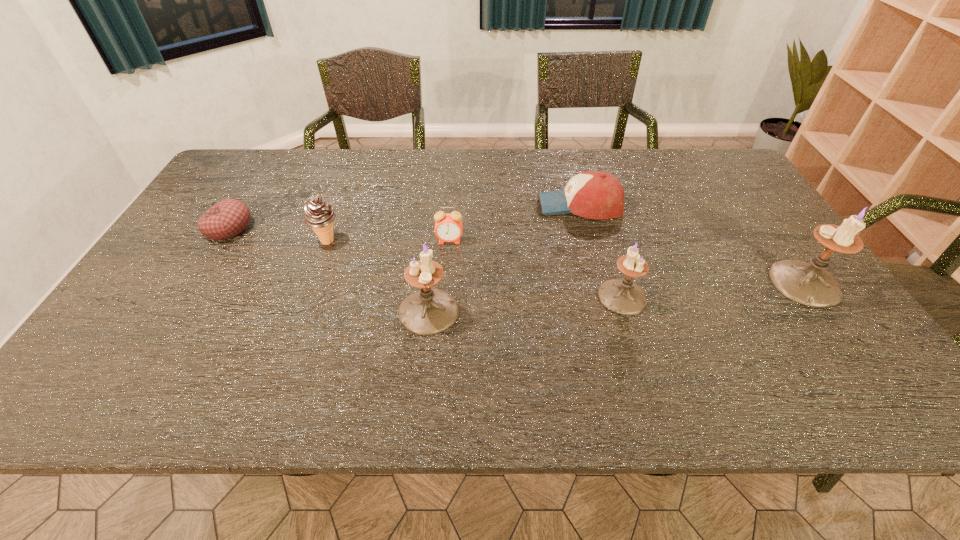
You are a GUI agent. You are given a task and a screenshot of the screen. Output one action in this format:
    pyautogui.click(x=<x>, y=<y>)
    Task: Click on the object at the right edge
    The image size is (960, 540).
    Given the screenshot: What is the action you would take?
    pyautogui.click(x=810, y=284)

Find the location of a particular element. vacant space at the far edge is located at coordinates (540, 171).

You are a GUI agent. You are given a task and a screenshot of the screen. Output one action in this format:
    pyautogui.click(x=<x>, y=<y>)
    Task: Click on the vacant space at the left edge of the desktop
    The width and height of the screenshot is (960, 540).
    Given the screenshot: What is the action you would take?
    pyautogui.click(x=256, y=196)

Locate an element on the screen. free space at the near left corner of the desktop is located at coordinates (123, 355).

This screenshot has height=540, width=960. Identify the location of free space at the far right corner. (692, 164).

Locate an element on the screen. The height and width of the screenshot is (540, 960). free point between the icecream and the rightmost object is located at coordinates (566, 262).

Find the location of a particular element. The width and height of the screenshot is (960, 540). free space between the baseball cap and the shortest object is located at coordinates (404, 217).

Locate an element on the screen. This screenshot has width=960, height=540. free space between the baseball cap and the second shortest candle holder is located at coordinates point(504,258).

Identify the location of unoccupied area between the alarm clock and the sixth object from right to left. (389, 241).

Where is `free space between the second tallest candle holder and the leftmost object`? The image size is (960, 540). free space between the second tallest candle holder and the leftmost object is located at coordinates (328, 269).